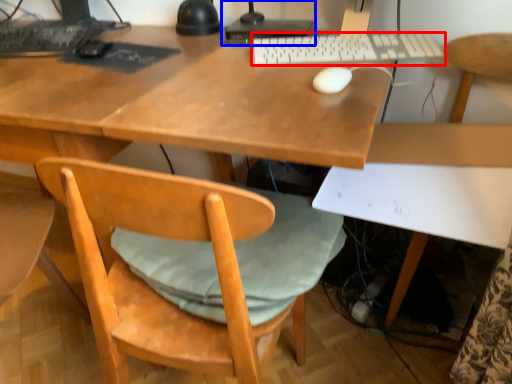
Question: Which of the following is the closest to the observer, computer keyboard (highlighted by a red box) or desktop computer (highlighted by a blue box)?

Choices:
 (A) computer keyboard
 (B) desktop computer

Answer: (A)